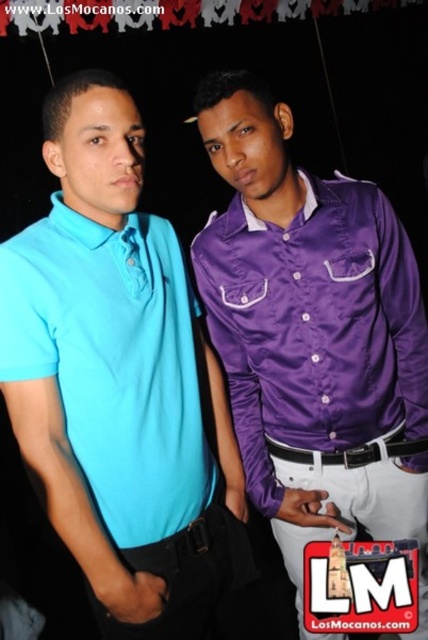
Question: Is matte blue polo shirt at left closer to camera compared to purple satin shirt at right?

Choices:
 (A) yes
 (B) no

Answer: (A)

Question: Is purple satin shirt at right smaller than white leather belt at center?

Choices:
 (A) yes
 (B) no

Answer: (B)

Question: Based on their relative distances, which object is nearer to the purple satin shirt at right?

Choices:
 (A) matte blue polo shirt at left
 (B) white leather belt at center

Answer: (A)

Question: Which object appears farthest from the camera in this image?

Choices:
 (A) matte blue polo shirt at left
 (B) purple satin shirt at right
 (C) white leather belt at center

Answer: (C)

Question: Which point is farther from the camera taking this photo?

Choices:
 (A) (51, 515)
 (B) (391, 435)
 (C) (359, 300)

Answer: (B)

Question: Considering the relative positions of matte blue polo shirt at left and purple satin shirt at right in the image provided, where is matte blue polo shirt at left located with respect to purple satin shirt at right?

Choices:
 (A) right
 (B) left

Answer: (B)